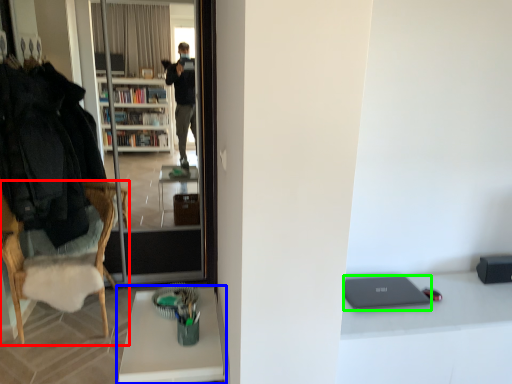
Question: Which object is the farthest from chair (highlighted by a red box)? Choose among these: desk (highlighted by a blue box) or laptop (highlighted by a green box).

Choices:
 (A) desk
 (B) laptop

Answer: (B)